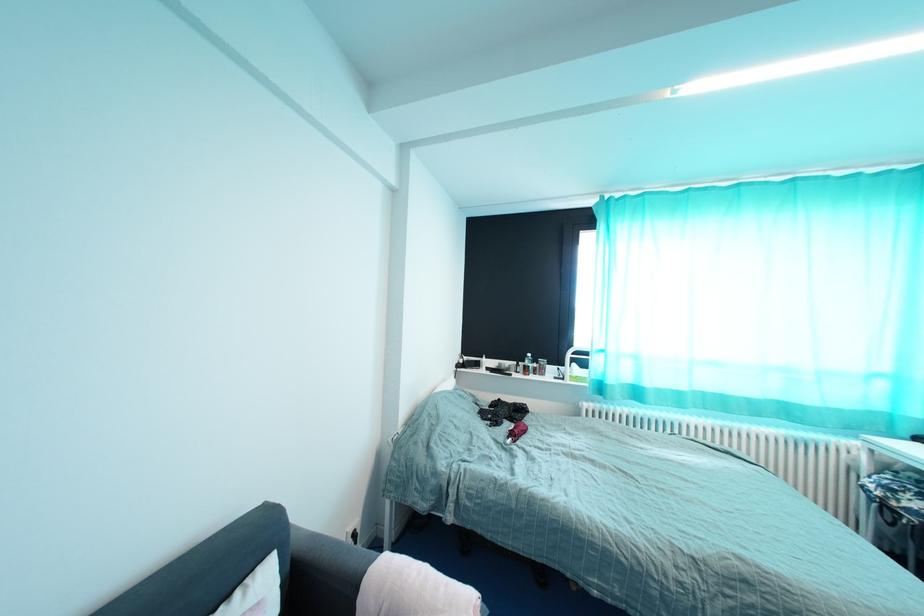
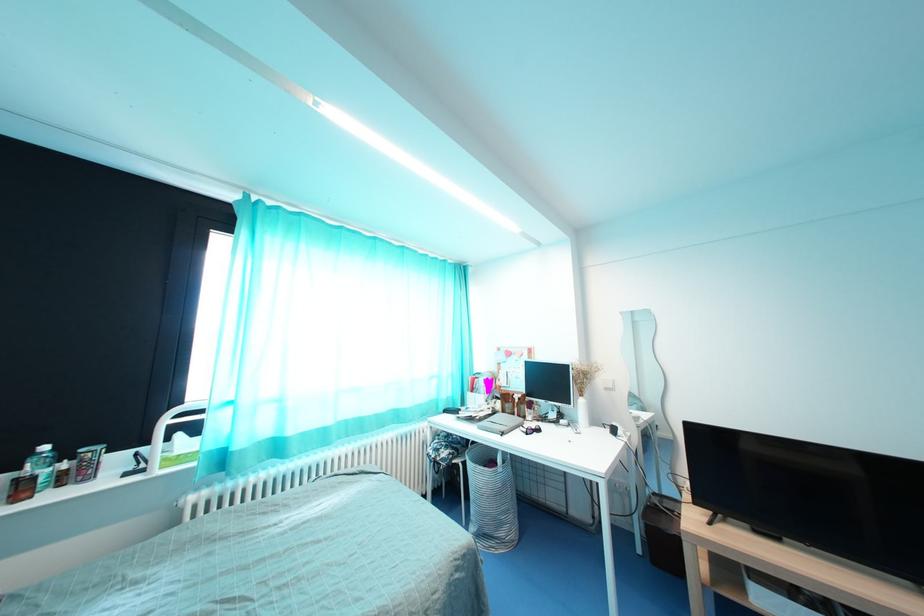
Question: How did the camera likely rotate?

Choices:
 (A) Left
 (B) Right
 (C) Up
 (D) Down

Answer: (B)